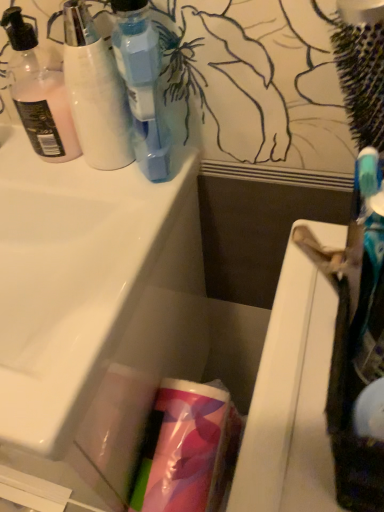
Image resolution: width=384 pixels, height=512 pixels. Find the location of `free spot in front of translucent pink lotion at left, which is the third bottle from right to left`. free spot in front of translucent pink lotion at left, which is the third bottle from right to left is located at coordinates (82, 200).